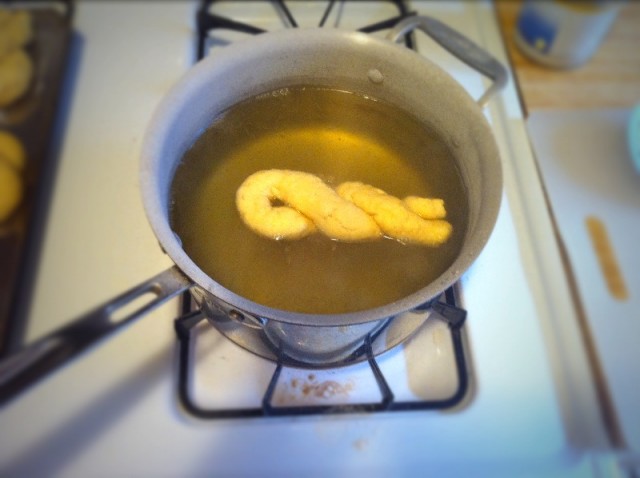
Locate an element on the screen. The image size is (640, 478). pot is located at coordinates (358, 348).